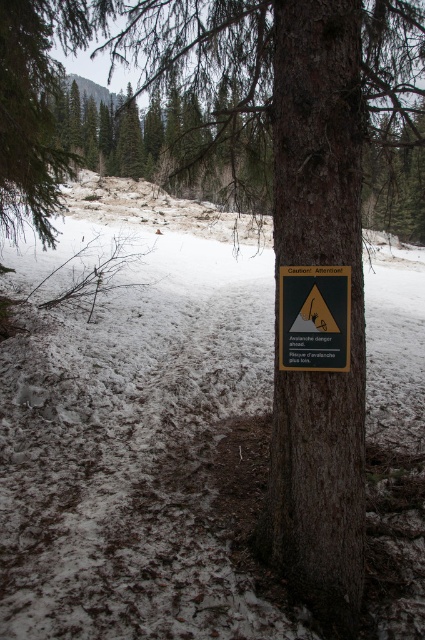
You are a hiker who wants to place a GPS tracker on the green plastic sign at center. You have a tracker that is 10 cm wide. The white powdery snow at center is 15 cm thick. Can the tracker be placed on the snow near the sign without sinking into the snow?

The white powdery snow at center is 15 cm thick, which is thicker than the GPS tracker width of 10 cm. Therefore, the tracker can be placed on the snow near the green plastic sign at center without sinking into the snow.

You are a hiker trying to navigate through the snowy forest. You see the white powdery snow at center and the green plastic sign at center. Which object is wider when viewed from above?

The white powdery snow at center is wider than the green plastic sign at center.

You are a hiker trying to navigate through the snowy forest. You see the white powdery snow at center and the green plastic sign at center. Which one is taller?

The white powdery snow at center is taller than the green plastic sign at center.